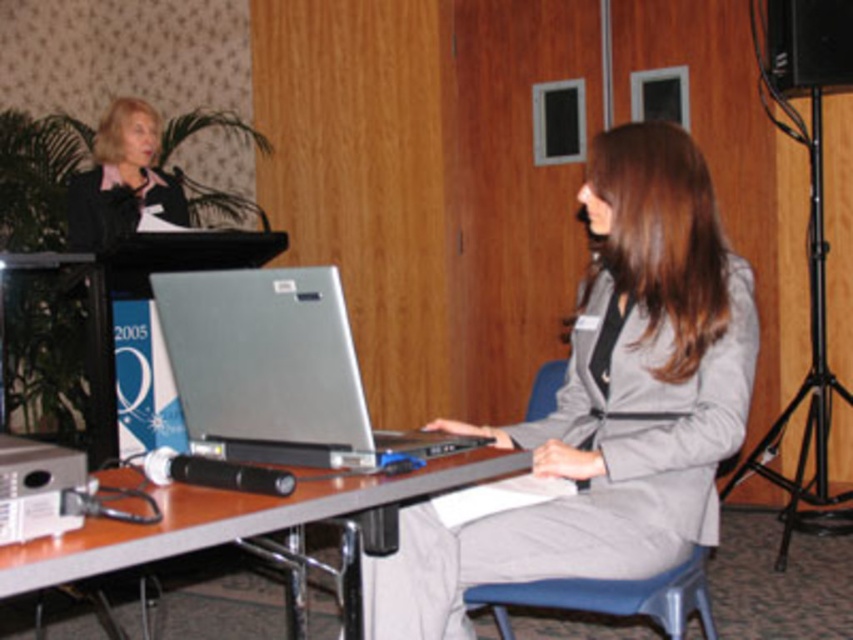
Does silver metallic laptop at center have a lesser height compared to black matte speaker at upper right?

Yes.

I want to click on silver metallic laptop at center, so click(276, 371).

Where is `silver metallic laptop at center`? This screenshot has height=640, width=853. silver metallic laptop at center is located at coordinates (276, 371).

Where is `silver metallic laptop at center`? This screenshot has width=853, height=640. silver metallic laptop at center is located at coordinates tap(276, 371).

Between gray fabric suit at center and black matte speaker at upper right, which one has more height?

Standing taller between the two is gray fabric suit at center.

Looking at this image, does gray fabric suit at center have a lesser height compared to black matte speaker at upper right?

Incorrect, gray fabric suit at center's height does not fall short of black matte speaker at upper right's.

Which is in front, point (631, 177) or point (779, 33)?

Point (631, 177)

Identify the location of gray fabric suit at center. The height and width of the screenshot is (640, 853). (608, 403).

Does gray fabric suit at center have a lesser height compared to blue plastic chair at lower center?

No, gray fabric suit at center is not shorter than blue plastic chair at lower center.

The width and height of the screenshot is (853, 640). What are the coordinates of `gray fabric suit at center` in the screenshot? It's located at (608, 403).

This screenshot has height=640, width=853. I want to click on gray fabric suit at center, so click(x=608, y=403).